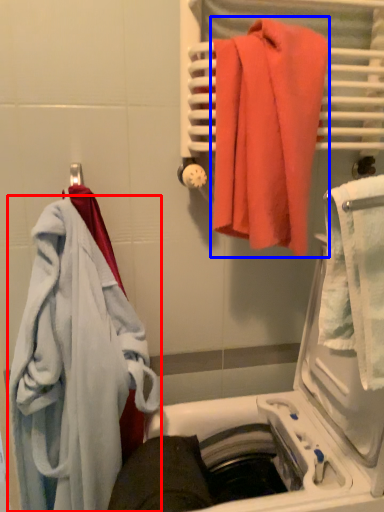
Question: Which of the following is the farthest to the observer, towel (highlighted by a red box) or towel (highlighted by a blue box)?

Choices:
 (A) towel
 (B) towel

Answer: (A)